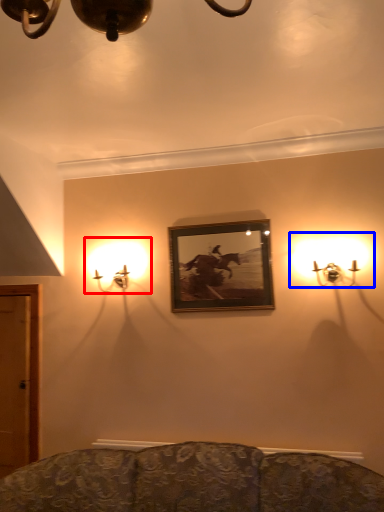
Question: Which point is further to the camera, lamp (highlighted by a red box) or lamp (highlighted by a blue box)?

Choices:
 (A) lamp
 (B) lamp

Answer: (A)